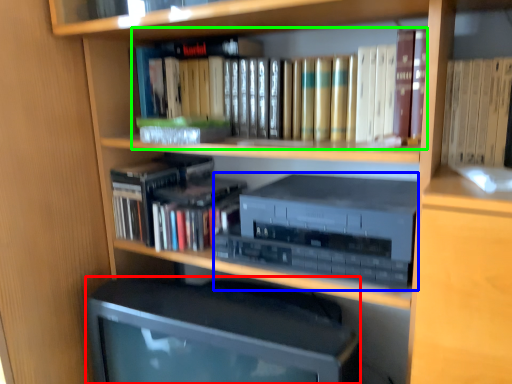
Question: Estimate the real-world distances between objects in this image. Which object is closer to computer monitor (highlighted by a red box), stereo (highlighted by a blue box) or book (highlighted by a green box)?

Choices:
 (A) stereo
 (B) book

Answer: (A)